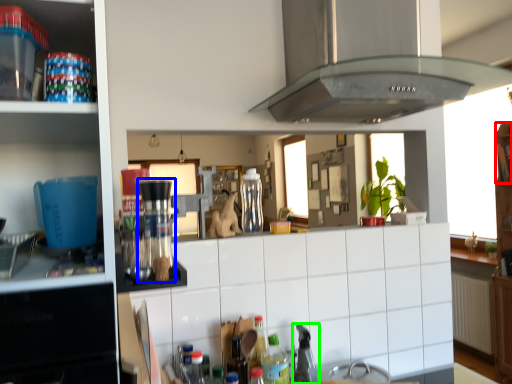
Question: Considering the real-world distances, which object is farthest from shelf (highlighted by a red box)? coffee machine (highlighted by a blue box) or appliance (highlighted by a green box)?

Choices:
 (A) coffee machine
 (B) appliance

Answer: (A)